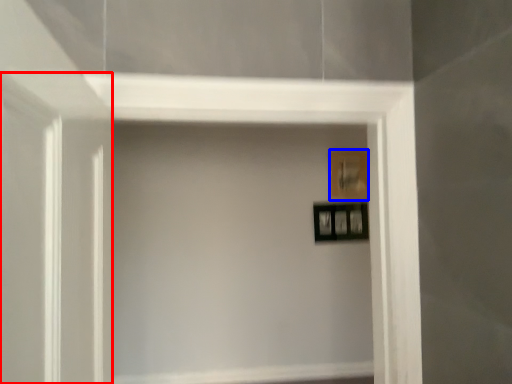
Question: Which point is closer to the camera, glass door (highlighted by a red box) or picture frame (highlighted by a blue box)?

Choices:
 (A) glass door
 (B) picture frame

Answer: (A)